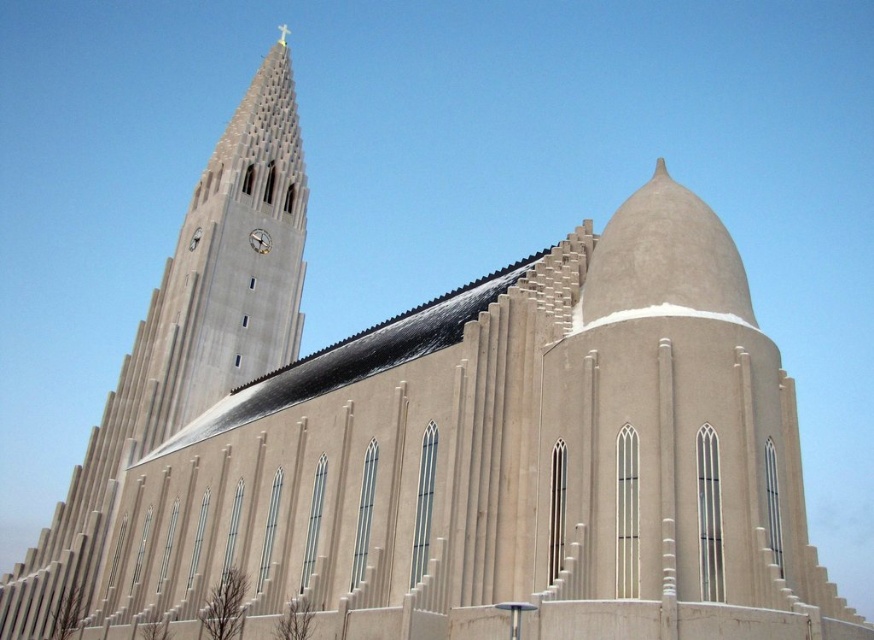
You are an architect analyzing the Hallgr?mskirkja Church in Reykjav?k. You notice the smooth concrete tower at upper left and the metallic clock face at upper center. Which object is taller?

The smooth concrete tower at upper left is taller than the metallic clock face at upper center.

You are an architect analyzing the Hallgr?mskirkja Church. You notice the smooth concrete tower at upper left and the metallic clock face at upper center. Based on their positions, which object is more likely to cast a longer shadow during midday?

The smooth concrete tower at upper left is taller than the metallic clock face at upper center, so it would cast a longer shadow during midday.

Based on the photo, you are standing at the entrance of Hallgr?mskirkja Church and notice a point marked at coordinates [186,337]. Based on the scene description, what architectural feature does this point most likely represent?

The point at [186,337] corresponds to the smooth concrete tower at upper left.